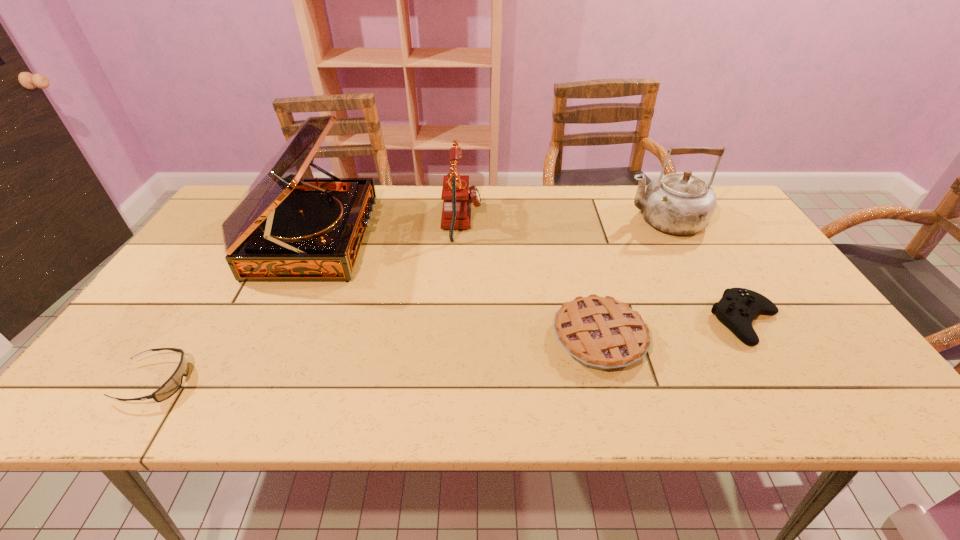
I want to click on record player, so click(284, 228).

Identify the location of kettle. The height and width of the screenshot is (540, 960). (679, 203).

Where is `the third object from left to right`? the third object from left to right is located at coordinates tap(457, 196).

Identify the location of telephone. This screenshot has width=960, height=540. (457, 196).

You are a GUI agent. You are given a task and a screenshot of the screen. Output one action in this format:
    pyautogui.click(x=<x>, y=<y>)
    Task: Click on the control
    
    Given the screenshot: What is the action you would take?
    pyautogui.click(x=738, y=307)

You are a GUI agent. You are given a task and a screenshot of the screen. Output one action in this format:
    pyautogui.click(x=<x>, y=<y>)
    Task: Click on the pie
    Image resolution: width=960 pixels, height=540 pixels.
    Given the screenshot: What is the action you would take?
    pyautogui.click(x=602, y=333)

Find the location of `goggles`. goggles is located at coordinates pos(172,385).

Find the location of a particular element. The image size is (960, 540). free spot located 0.370m on the front-facing side of the record player is located at coordinates (497, 238).

Where is `vacant space situated 0.140m at the spout of the kettle`? The image size is (960, 540). vacant space situated 0.140m at the spout of the kettle is located at coordinates (578, 220).

At what (x,y) coordinates should I click in order to perform the action: click on vacant space situated at the spout of the kettle. Please return your answer as a coordinate pair (x, y). The height and width of the screenshot is (540, 960). Looking at the image, I should click on (542, 220).